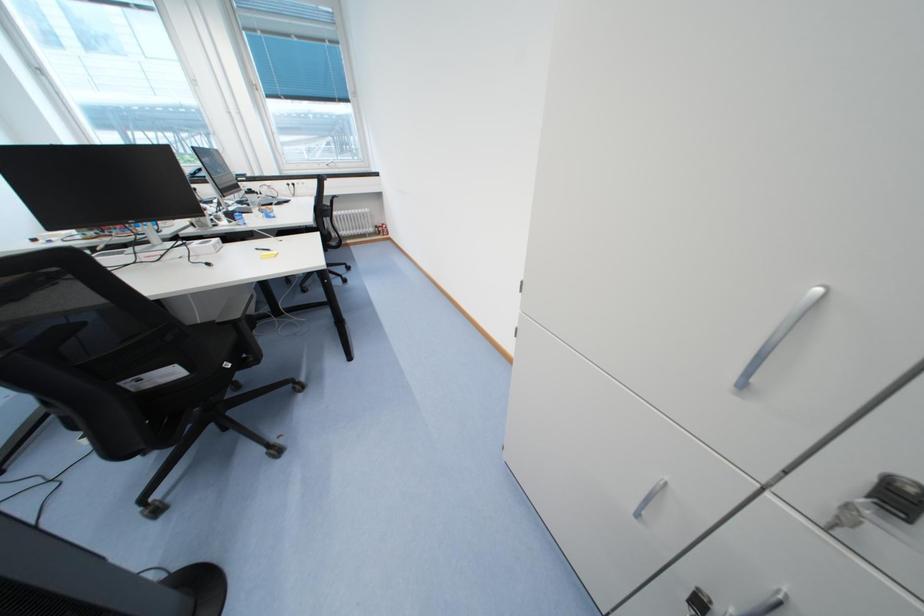
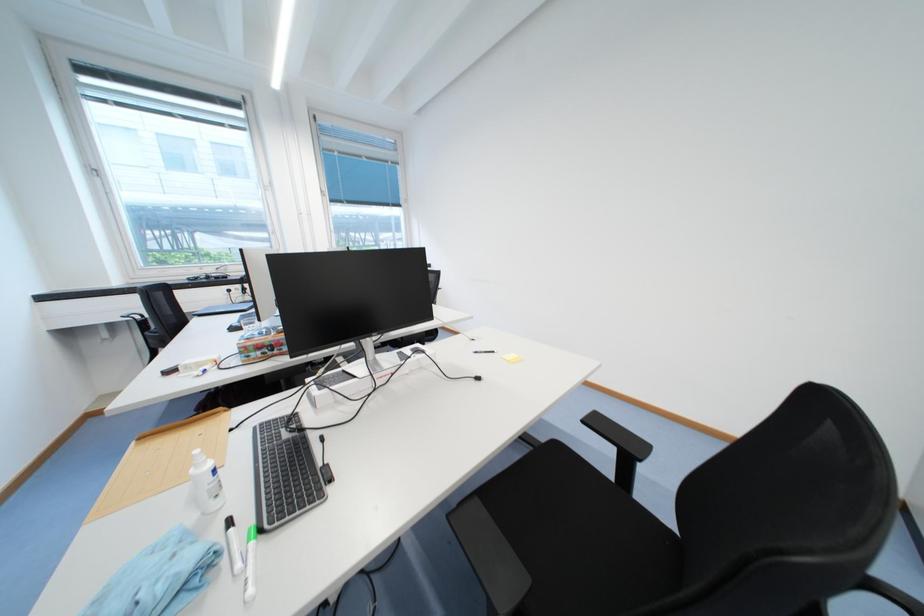
Question: What movement of the cameraman would produce the second image?

Choices:
 (A) Left
 (B) Right
 (C) Forward
 (D) Backward

Answer: (A)